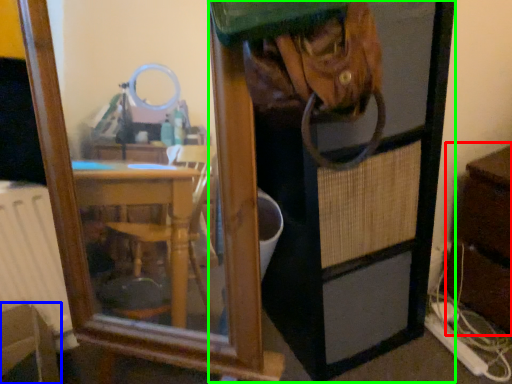
Question: Based on their relative distances, which object is farther from dresser (highlighted by a red box)? Choose from furniture (highlighted by a blue box) and screen door (highlighted by a green box).

Choices:
 (A) furniture
 (B) screen door

Answer: (A)